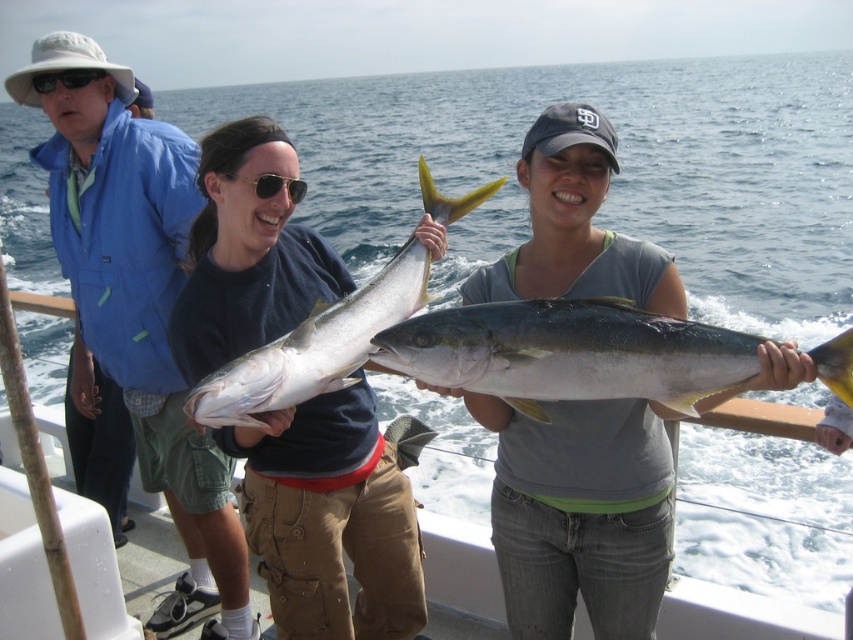
Question: Which is farther from the black plastic sunglasses at upper left?

Choices:
 (A) sunglasses at center
 (B) gray cotton t-shirt at center
 (C) shiny blue shirt at center

Answer: (B)

Question: Estimate the real-world distances between objects in this image. Which object is farther from the black plastic sunglasses at upper left?

Choices:
 (A) gray cotton t-shirt at center
 (B) yellow shiny fish at center

Answer: (A)

Question: Does yellowish metallic fish at center appear over black plastic sunglasses at upper left?

Choices:
 (A) yes
 (B) no

Answer: (B)

Question: Is the position of blue fabric jacket at upper left less distant than that of yellow shiny fish at center?

Choices:
 (A) yes
 (B) no

Answer: (B)

Question: Does gray cotton t-shirt at center have a greater width compared to yellowish metallic fish at center?

Choices:
 (A) no
 (B) yes

Answer: (A)

Question: Which of these objects is positioned closest to the gray cotton t-shirt at center?

Choices:
 (A) blue fabric jacket at upper left
 (B) sunglasses at center

Answer: (B)